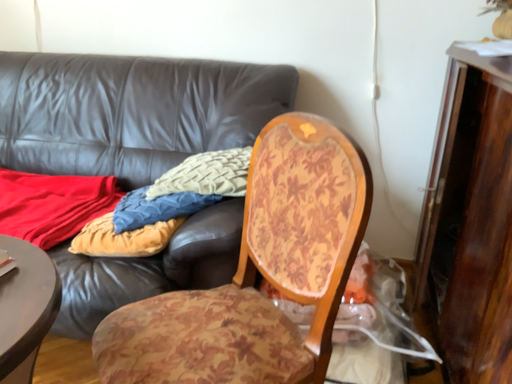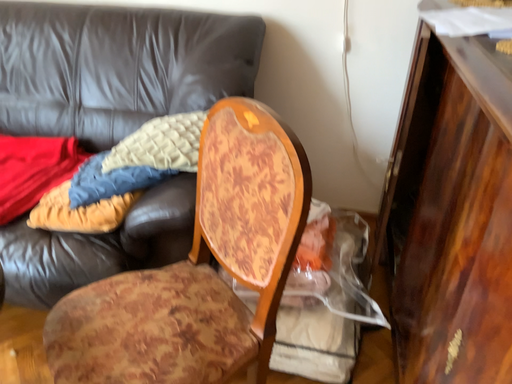
Question: Which way did the camera rotate in the video?

Choices:
 (A) rotated downward
 (B) rotated upward

Answer: (A)